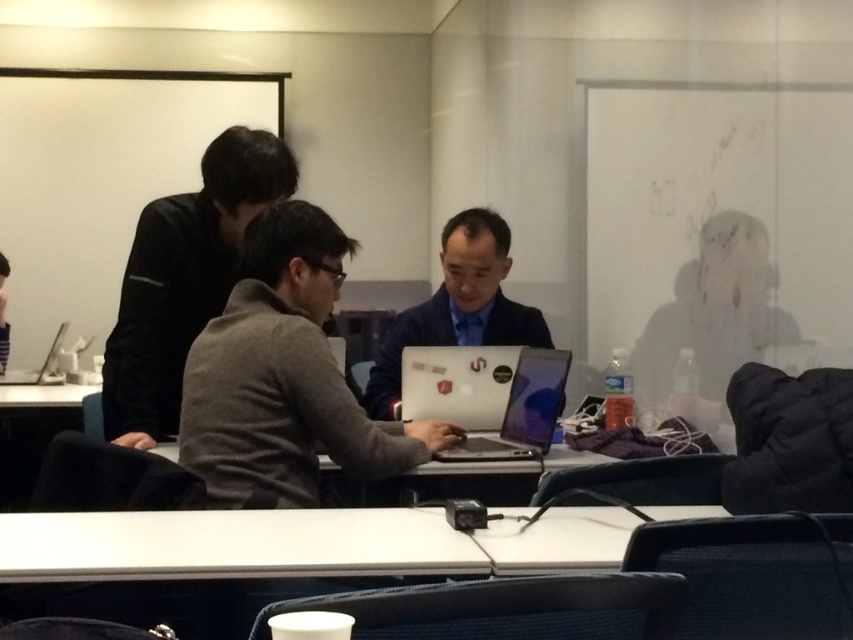
Question: Is gray sweater at center in front of matte black laptop at center?

Choices:
 (A) yes
 (B) no

Answer: (A)

Question: Can you confirm if gray sweater at center is bigger than matte black laptop at center?

Choices:
 (A) yes
 (B) no

Answer: (A)

Question: In this image, where is satin black laptop at center located relative to silver metallic laptop at lower left?

Choices:
 (A) right
 (B) left

Answer: (A)

Question: Which of the following is the closest to the observer?

Choices:
 (A) (509, 259)
 (B) (32, 380)

Answer: (A)

Question: Which object is the closest to the matte black laptop at center?

Choices:
 (A) silver metallic laptop at lower left
 (B) satin silver laptop at center

Answer: (B)

Question: Which is farther from the matte black jacket at right?

Choices:
 (A) gray sweater at center
 (B) satin silver laptop at center
 (C) black matte jacket at upper left

Answer: (C)